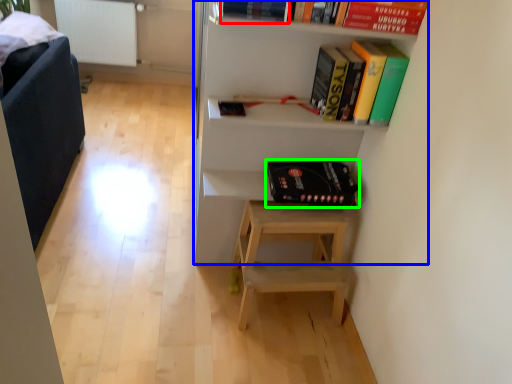
Question: Which object is positioned closest to book (highlighted by a red box)? Select from shelf (highlighted by a blue box) and paperback book (highlighted by a green box).

Choices:
 (A) shelf
 (B) paperback book

Answer: (A)